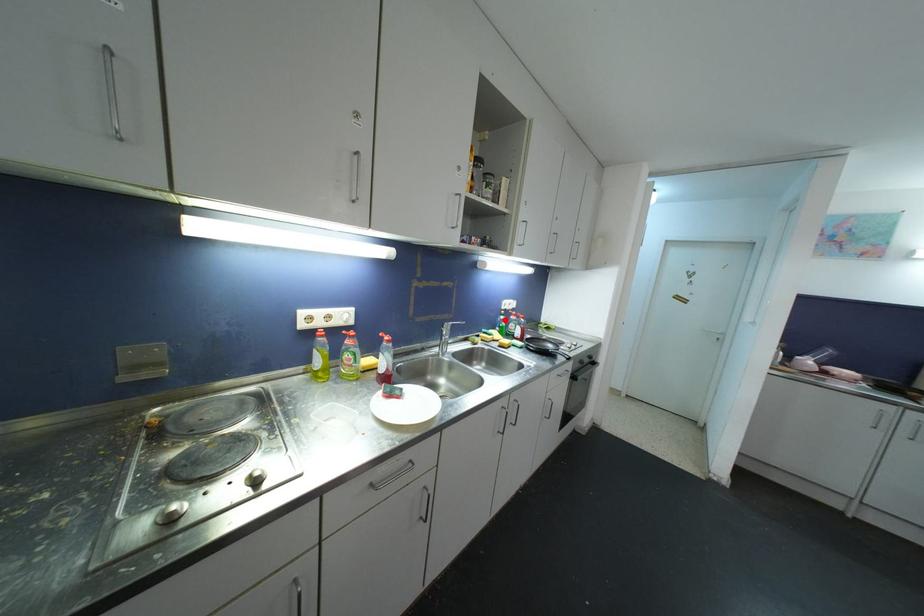
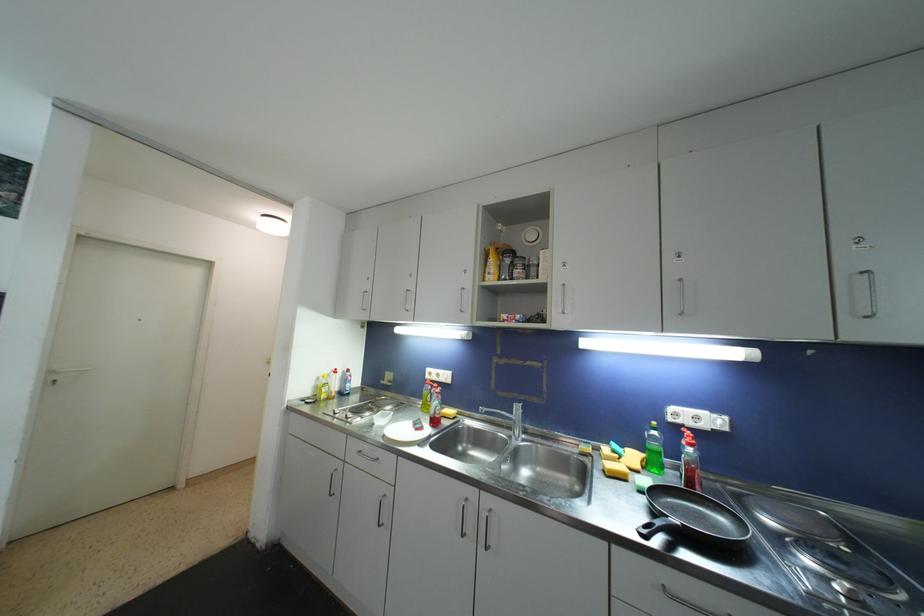
In the second image, find the point that corresponds to the highlighted location in the first image.

(658, 436)